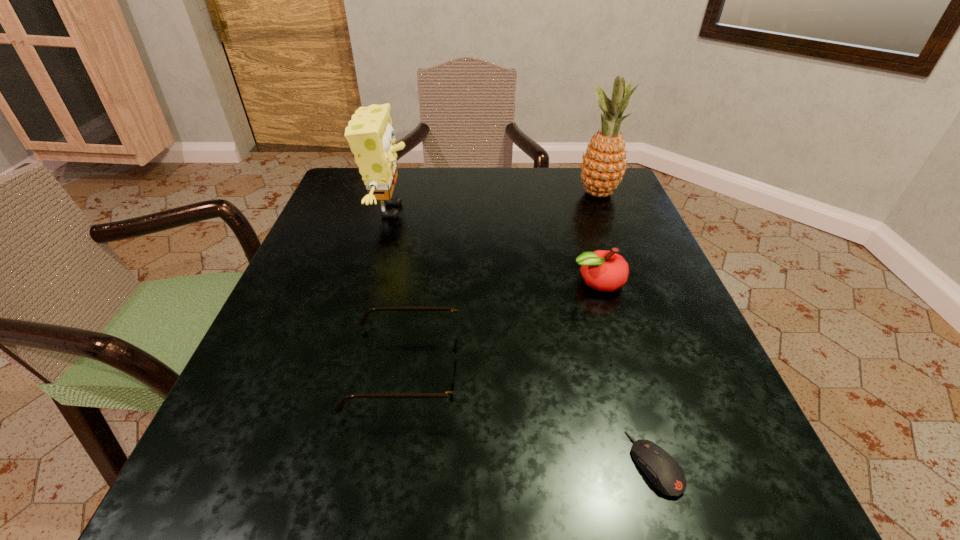
Identify the location of unoccupied area between the shortest object and the pineapple. The height and width of the screenshot is (540, 960). point(627,328).

Identify which object is the nearest to the sponge. Please provide its 2D coordinates. Your answer should be formatted as a tuple, i.e. [(x, y)], where the tuple contains the x and y coordinates of a point satisfying the conditions above.

[(455, 350)]

Select which object appears as the second closest to the tallest object. Please provide its 2D coordinates. Your answer should be formatted as a tuple, i.e. [(x, y)], where the tuple contains the x and y coordinates of a point satisfying the conditions above.

[(370, 135)]

I want to click on vacant space that satisfies the following two spatial constraints: 1. at the hinge ends of the nearest object; 2. on the left side of the second nearest object, so click(x=391, y=463).

What are the coordinates of `vacant space that satisfies the following two spatial constraints: 1. on the back side of the nearest object; 2. at the hinge ends of the second nearest object` in the screenshot? It's located at (626, 369).

At what (x,y) coordinates should I click in order to perform the action: click on vacant region that satisfies the following two spatial constraints: 1. on the back side of the shortest object; 2. at the hinge ends of the second nearest object. Please return your answer as a coordinate pair (x, y). Looking at the image, I should click on (626, 369).

This screenshot has width=960, height=540. In order to click on vacant space that satisfies the following two spatial constraints: 1. on the face of the sponge; 2. on the left side of the third shortest object in this screenshot , I will do `click(370, 282)`.